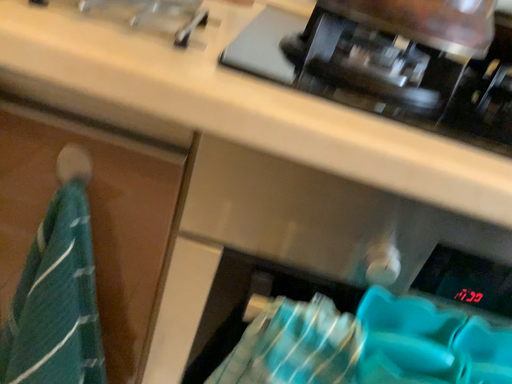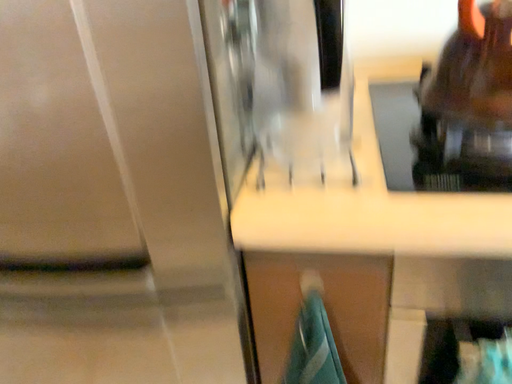
Question: Which way did the camera rotate in the video?

Choices:
 (A) rotated right
 (B) rotated left

Answer: (B)